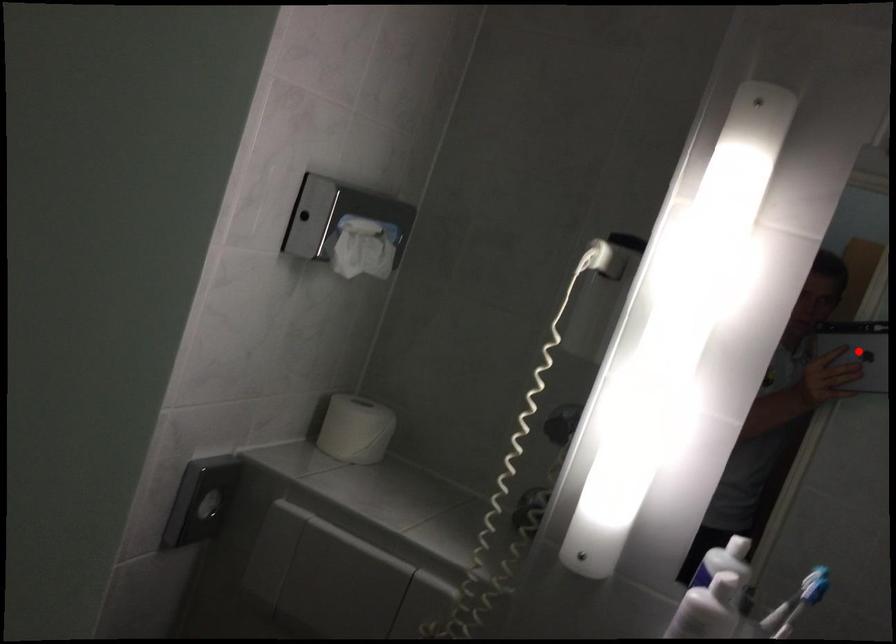
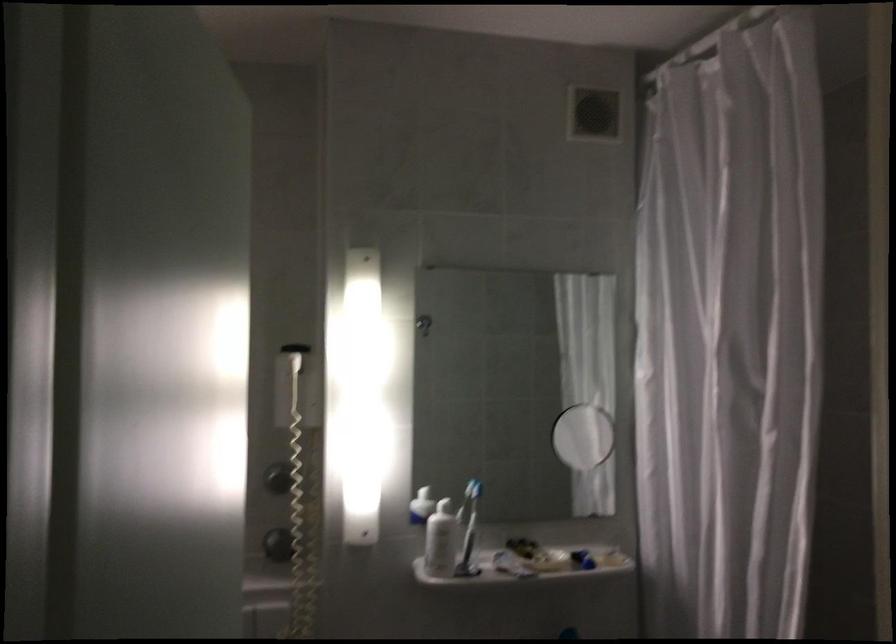
Question: I am providing you with two images of the same scene from different viewpoints. A red point is marked on the first image. At the location where the point appears in image 1, is it still visible in image 2?

Choices:
 (A) Yes
 (B) No

Answer: (B)